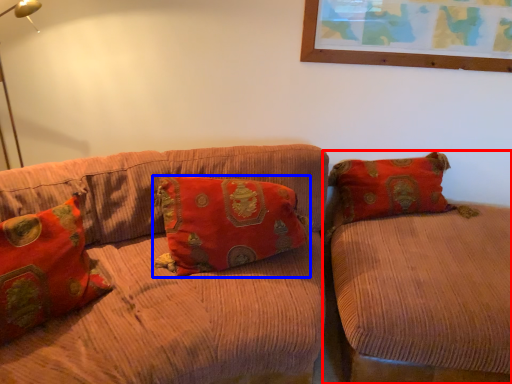
Question: Which of the following is the closest to the observer, studio couch (highlighted by a red box) or pillow (highlighted by a blue box)?

Choices:
 (A) studio couch
 (B) pillow

Answer: (A)